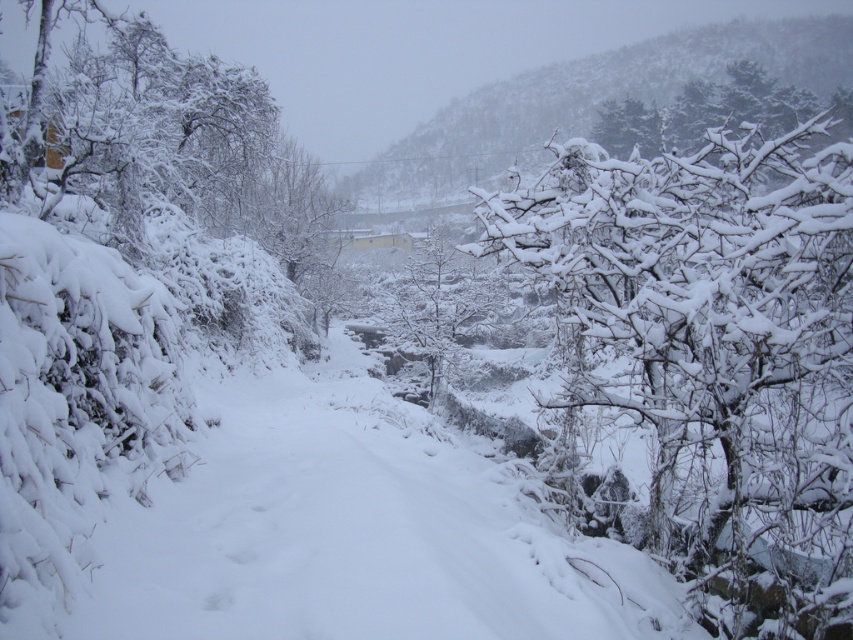
Question: Which point is closer to the camera?

Choices:
 (A) white snow-covered tree at center
 (B) white snow-covered tree at upper right

Answer: (B)

Question: Is white snow-covered branches at upper right in front of white snow-covered tree at center?

Choices:
 (A) yes
 (B) no

Answer: (B)

Question: Is white snow-covered branches at upper right to the right of white snow-covered tree at center from the viewer's perspective?

Choices:
 (A) yes
 (B) no

Answer: (A)

Question: Which point is farther to the camera?

Choices:
 (A) white snow-covered branches at upper right
 (B) white snow-covered tree at upper right
 (C) white snow-covered tree at center

Answer: (A)

Question: Is the position of white snow-covered tree at upper right more distant than that of white snow-covered branches at upper right?

Choices:
 (A) yes
 (B) no

Answer: (B)

Question: Which point is farther from the camera taking this photo?

Choices:
 (A) pos(770,92)
 (B) pos(676,476)
 (C) pos(451,330)

Answer: (A)